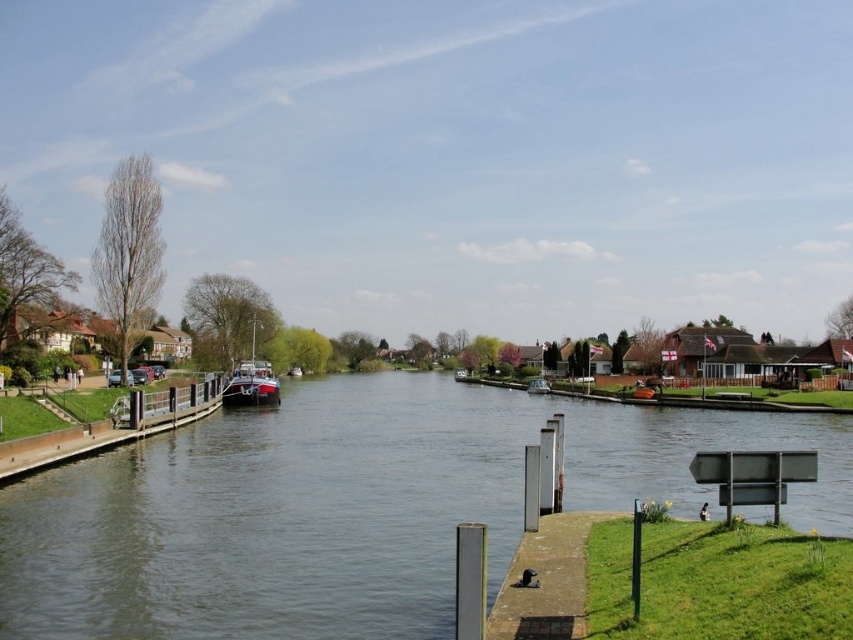
Describe the element at coordinates (349, 508) in the screenshot. The height and width of the screenshot is (640, 853). I see `clear water at center` at that location.

Identify the location of clear water at center. The width and height of the screenshot is (853, 640). (349, 508).

Who is positioned more to the left, red polished wood boat at center-left or matte black boat at center?

Positioned to the left is red polished wood boat at center-left.

In the scene shown: Who is taller, red polished wood boat at center-left or matte black boat at center?

Standing taller between the two is red polished wood boat at center-left.

The width and height of the screenshot is (853, 640). I want to click on red polished wood boat at center-left, so click(251, 381).

I want to click on red polished wood boat at center-left, so click(x=251, y=381).

Is smooth concrete dock at left positioned in front of matte black boat at center?

That is True.

Describe the element at coordinates (112, 426) in the screenshot. The width and height of the screenshot is (853, 640). I see `smooth concrete dock at left` at that location.

Identify the location of smooth concrete dock at left. This screenshot has width=853, height=640. (112, 426).